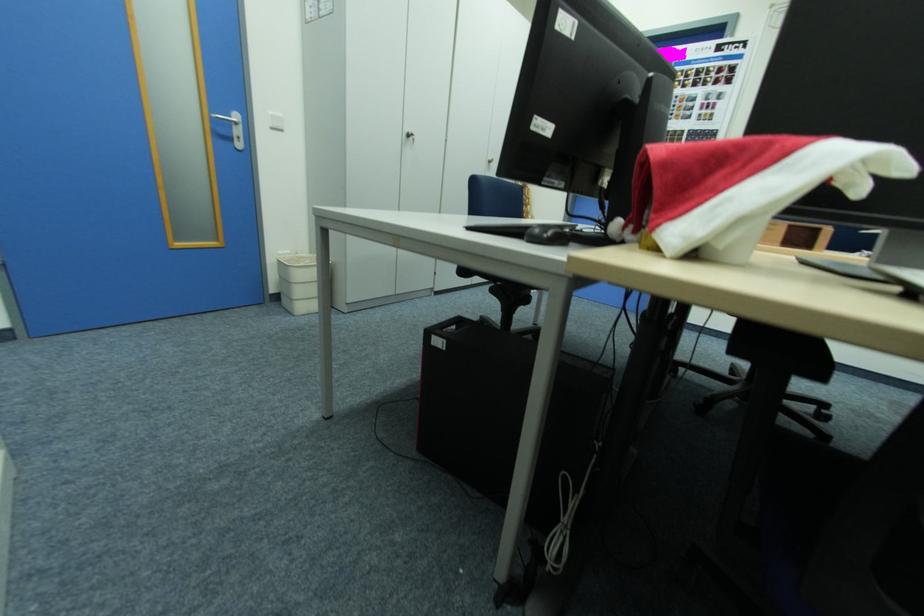
Locate an element on the screen. cabinet lock is located at coordinates (409, 136).